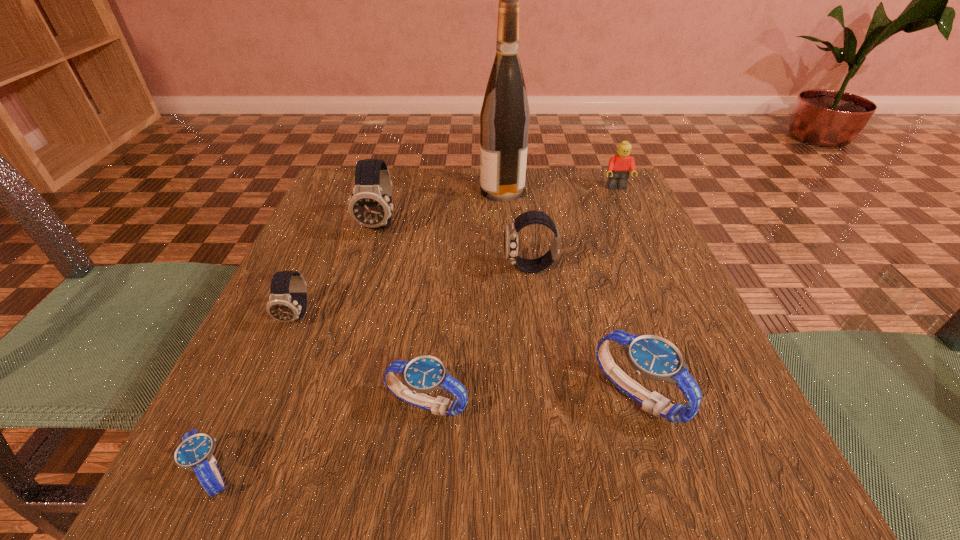
At what (x,y) coordinates should I click in order to perform the action: click on vacant point located on the back of the rightmost blue watch. Please return your answer as a coordinate pair (x, y). Image resolution: width=960 pixels, height=540 pixels. Looking at the image, I should click on (586, 227).

Where is `free space located on the face of the third farthest watch`? free space located on the face of the third farthest watch is located at coordinates (244, 440).

Where is `free region located on the left of the third watch from right to left`? Image resolution: width=960 pixels, height=540 pixels. free region located on the left of the third watch from right to left is located at coordinates (287, 404).

I want to click on blank space located on the back of the leftmost blue watch, so click(x=297, y=289).

At what (x,y) coordinates should I click in order to perform the action: click on wine bottle that is at the far edge. Please return your answer as a coordinate pair (x, y). This screenshot has height=540, width=960. Looking at the image, I should click on (504, 119).

Identify the location of watch positioned at the far edge. (370, 205).

I want to click on Lego at the far edge, so click(x=620, y=165).

At what (x,y) coordinates should I click in order to perform the action: click on object that is at the near edge. Please return your answer as a coordinate pair (x, y). This screenshot has height=540, width=960. Looking at the image, I should click on (195, 451).

I want to click on Lego located at the right edge, so coord(620,165).

Image resolution: width=960 pixels, height=540 pixels. In order to click on watch that is at the right edge in this screenshot , I will do `click(653, 357)`.